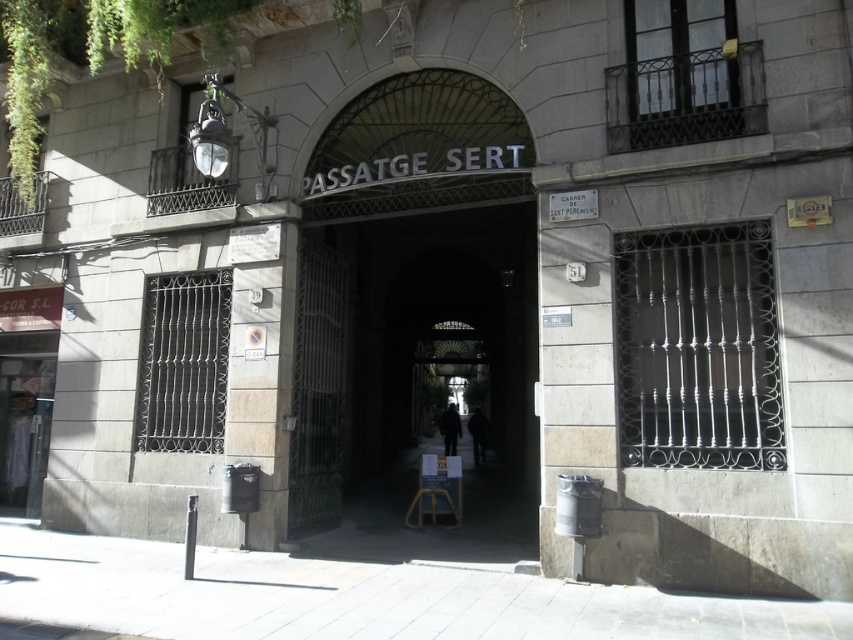
Question: Does dark metal gate at center appear on the right side of wooden stool at center?

Choices:
 (A) no
 (B) yes

Answer: (B)

Question: Is dark metal gate at center above wooden stool at center?

Choices:
 (A) no
 (B) yes

Answer: (B)

Question: Among these points, which one is farthest from the camera?

Choices:
 (A) (425, 488)
 (B) (337, 385)

Answer: (A)

Question: Among these points, which one is farthest from the camera?

Choices:
 (A) (407, 509)
 (B) (488, 292)

Answer: (B)

Question: Is dark metal gate at center thinner than wooden stool at center?

Choices:
 (A) yes
 (B) no

Answer: (B)

Question: Which object appears closest to the camera in this image?

Choices:
 (A) dark metal gate at center
 (B) wooden stool at center

Answer: (A)